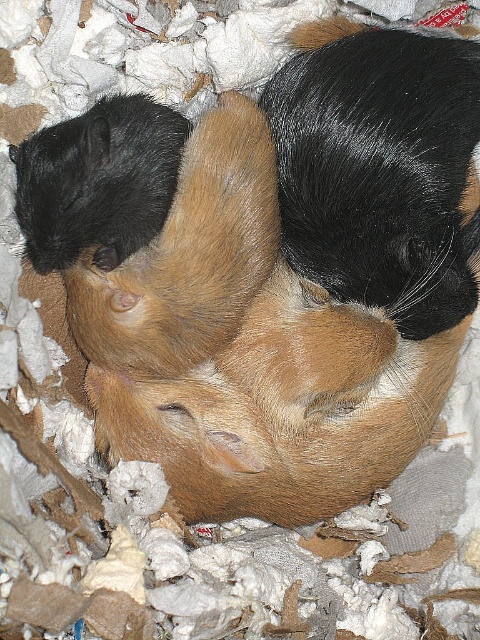
Question: Does brown fuzzy guinea pig at center appear on the left side of black fuzzy guinea pig at upper left?

Choices:
 (A) no
 (B) yes

Answer: (A)

Question: In this image, where is brown fuzzy guinea pig at center located relative to black fuzzy guinea pig at upper left?

Choices:
 (A) below
 (B) above

Answer: (A)

Question: Can you confirm if brown fuzzy guinea pig at center is wider than black fuzzy guinea pig at upper left?

Choices:
 (A) no
 (B) yes

Answer: (B)